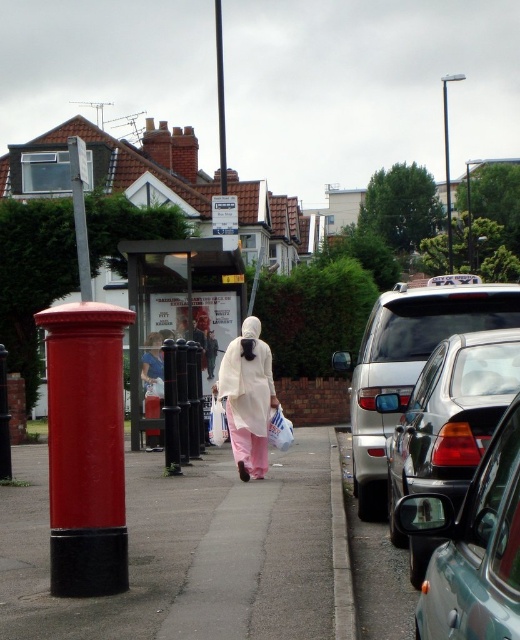
Which is in front, point (230, 404) or point (221, 61)?

Point (230, 404) is in front.

Which is behind, point (248, 429) or point (218, 68)?

The point (218, 68) is behind.

This screenshot has width=520, height=640. Find the location of `white matte dress at center`. white matte dress at center is located at coordinates (248, 397).

Is point (504, 582) in front of point (158, 397)?

Yes.

Is metallic silver car at right in front of light beige fabric at center?

Yes, it is in front of light beige fabric at center.

Is point (478, 513) behind point (148, 356)?

No, (478, 513) is in front of (148, 356).

Where is `metallic silver car at right`? metallic silver car at right is located at coordinates (473, 547).

Can you confirm if smooth concrete sidewalk at center is positioned to the left of matte red postbox at left?

Yes, smooth concrete sidewalk at center is to the left of matte red postbox at left.

Between point (209, 582) and point (60, 557), which one is positioned in front?

Point (60, 557)

Image resolution: width=520 pixels, height=640 pixels. I want to click on smooth concrete sidewalk at center, so click(187, 552).

The width and height of the screenshot is (520, 640). Find the location of `smooth concrete sidewalk at center`. smooth concrete sidewalk at center is located at coordinates (187, 552).